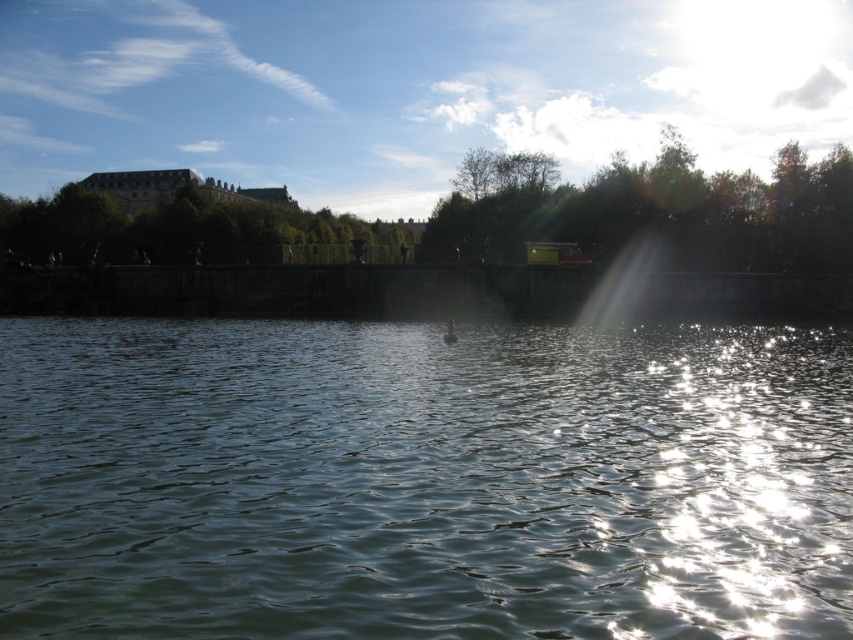
Question: Is green leafy tree at upper right above green leafy tree at upper center?

Choices:
 (A) no
 (B) yes

Answer: (B)

Question: Which point is closer to the camera taking this photo?

Choices:
 (A) (480, 444)
 (B) (515, 186)
 (C) (219, 259)

Answer: (A)

Question: Which of the following is the farthest from the observer?

Choices:
 (A) (526, 204)
 (B) (277, 225)
 (C) (96, 586)

Answer: (B)

Question: Is green leafy tree at upper right thinner than green leafy tree at upper center?

Choices:
 (A) yes
 (B) no

Answer: (B)

Question: Which object is farther from the camera taking this photo?

Choices:
 (A) green leafy tree at upper center
 (B) clear water at center
 (C) green leafy tree at upper right

Answer: (A)

Question: Can you confirm if green leafy tree at upper right is positioned above green leafy tree at upper center?

Choices:
 (A) yes
 (B) no

Answer: (A)